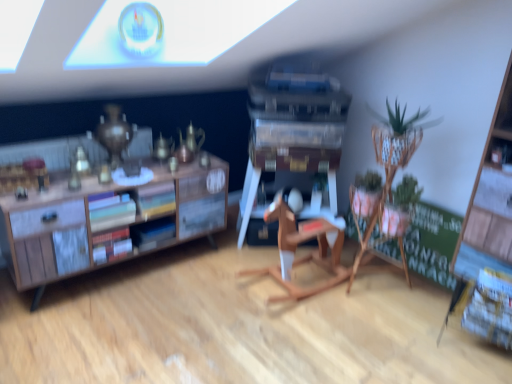
Identify the location of free spot above matte hardcover books at center left, placed as the 1th book when sorted from top to bottom (from a real-world perspective). (109, 190).